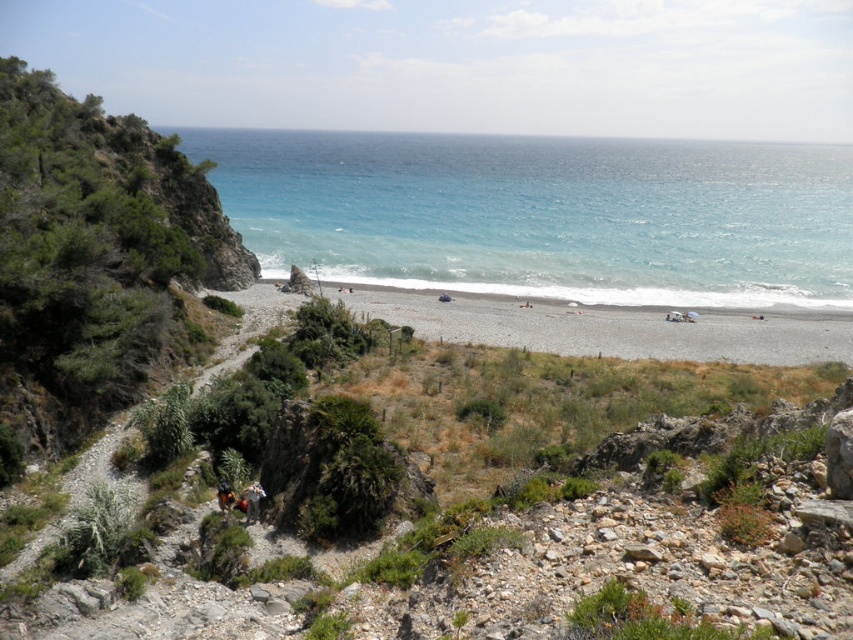
You are a hiker planning to walk along the path in the coastal scene. You notice the green shrubbery at left and the camouflage fabric person at lower center. Which object is bigger in size?

The green shrubbery at left is larger in size compared to the camouflage fabric person at lower center according to the description.